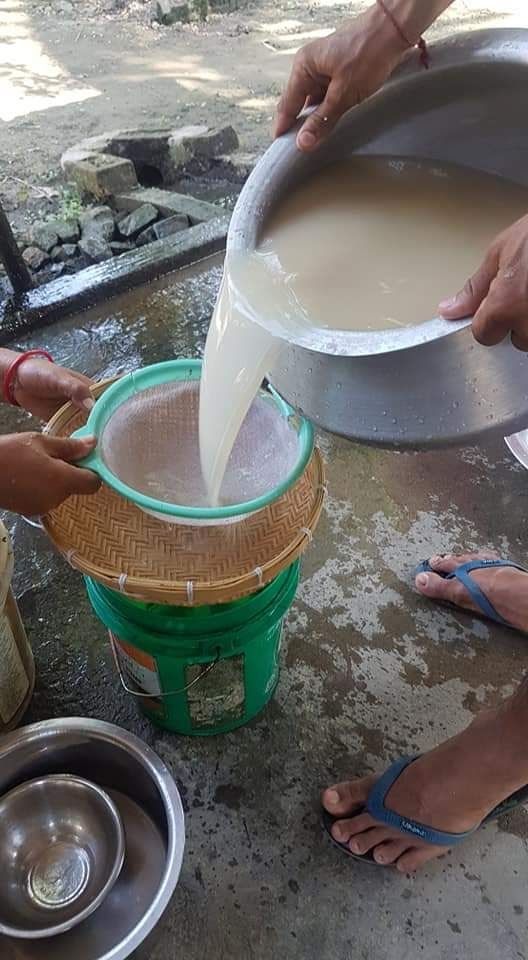
Find the location of a particular element. green bucket is located at coordinates click(x=240, y=682).